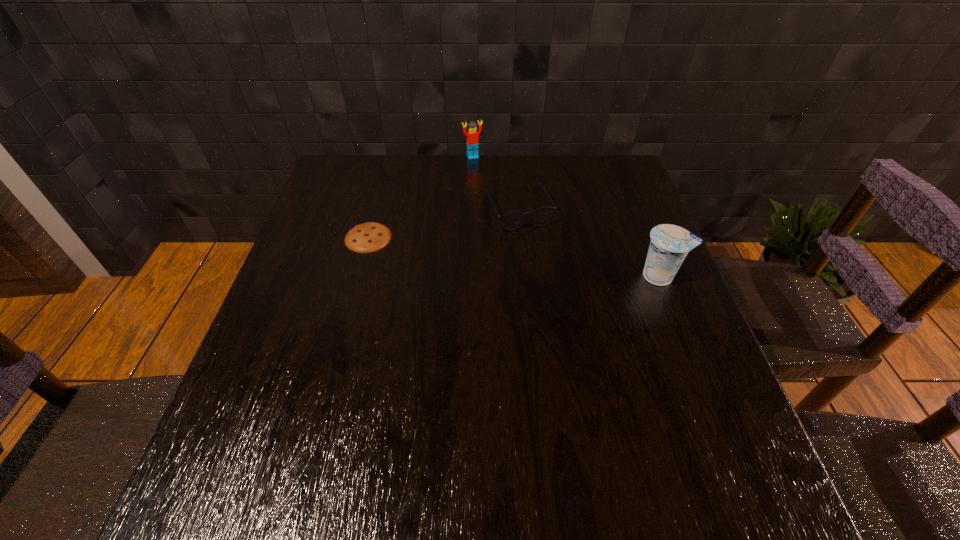
You are a GUI agent. You are given a task and a screenshot of the screen. Output one action in this format:
    pyautogui.click(x=<x>, y=<y>)
    Task: Click on the shortest object
    This screenshot has width=960, height=540.
    Given the screenshot: What is the action you would take?
    pyautogui.click(x=364, y=238)

This screenshot has width=960, height=540. In order to click on the leftmost object in this screenshot , I will do `click(364, 238)`.

Find the location of a particular element. the rightmost object is located at coordinates (670, 244).

Locate an element on the screen. The image size is (960, 540). yogurt is located at coordinates click(x=670, y=244).

Identify the location of Lego. Image resolution: width=960 pixels, height=540 pixels. (472, 139).

Find the location of a particular element. This screenshot has width=960, height=540. the third object from right to left is located at coordinates point(472,139).

Identify the location of spectacles. (513, 220).

I want to click on the third object from left to right, so click(x=513, y=220).

This screenshot has width=960, height=540. What are the coordinates of `vacant space located on the back of the leftmost object` in the screenshot? It's located at (389, 160).

Find the location of `vacant space located 0.310m on the front of the rightmost object`. vacant space located 0.310m on the front of the rightmost object is located at coordinates (716, 417).